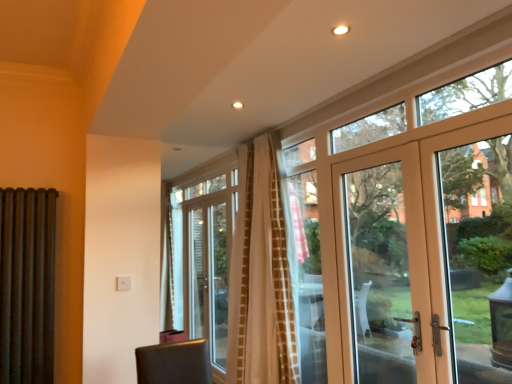
Question: From a real-world perspective, is rusty metal radiator at left positioned under white textured curtain at center based on gravity?

Choices:
 (A) no
 (B) yes

Answer: (B)

Question: Is white textured curtain at center surrounded by rusty metal radiator at left?

Choices:
 (A) no
 (B) yes

Answer: (A)

Question: Considering the relative positions of rusty metal radiator at left and white textured curtain at center in the image provided, is rusty metal radiator at left to the right of white textured curtain at center from the viewer's perspective?

Choices:
 (A) no
 (B) yes

Answer: (A)

Question: Can you confirm if rusty metal radiator at left is shorter than white textured curtain at center?

Choices:
 (A) yes
 (B) no

Answer: (A)

Question: Is there a large distance between rusty metal radiator at left and white textured curtain at center?

Choices:
 (A) no
 (B) yes

Answer: (B)

Question: Considering the positions of point (347, 135) and point (391, 168), is point (347, 135) closer or farther from the camera than point (391, 168)?

Choices:
 (A) closer
 (B) farther

Answer: (A)

Question: From a real-world perspective, is clear glass door at upper right physically located above or below matte white door at right?

Choices:
 (A) above
 (B) below

Answer: (A)

Question: Looking at the image, does clear glass door at upper right seem bigger or smaller compared to matte white door at right?

Choices:
 (A) big
 (B) small

Answer: (B)

Question: Based on their positions, is clear glass door at upper right located to the left or right of matte white door at right?

Choices:
 (A) left
 (B) right

Answer: (A)

Question: From the image's perspective, is rusty metal radiator at left above or below white textured curtain at center?

Choices:
 (A) above
 (B) below

Answer: (B)

Question: Considering the positions of rusty metal radiator at left and white textured curtain at center in the image, is rusty metal radiator at left wider or thinner than white textured curtain at center?

Choices:
 (A) wide
 (B) thin

Answer: (B)

Question: In terms of size, does rusty metal radiator at left appear bigger or smaller than white textured curtain at center?

Choices:
 (A) big
 (B) small

Answer: (B)

Question: Is point (37, 372) positioned closer to the camera than point (233, 352)?

Choices:
 (A) farther
 (B) closer

Answer: (B)

Question: Is clear glass door at upper right taller or shorter than white textured curtain at center?

Choices:
 (A) short
 (B) tall

Answer: (A)

Question: Is clear glass door at upper right in front of or behind white textured curtain at center in the image?

Choices:
 (A) front
 (B) behind

Answer: (A)